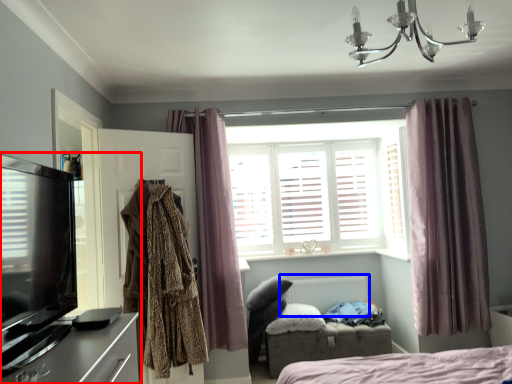
Question: Which object is closer to the camera taking this photo, entertainment center (highlighted by a red box) or radiator (highlighted by a blue box)?

Choices:
 (A) entertainment center
 (B) radiator

Answer: (A)